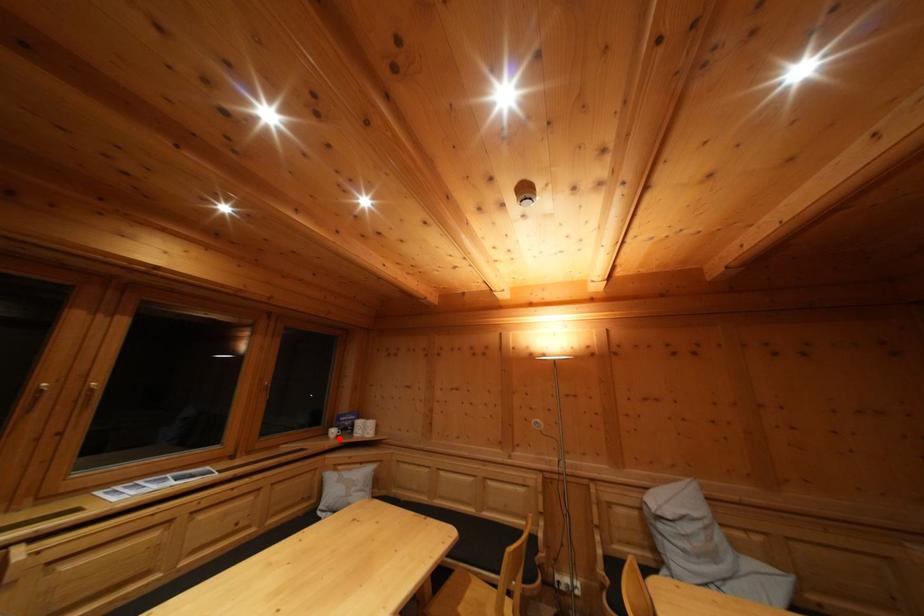
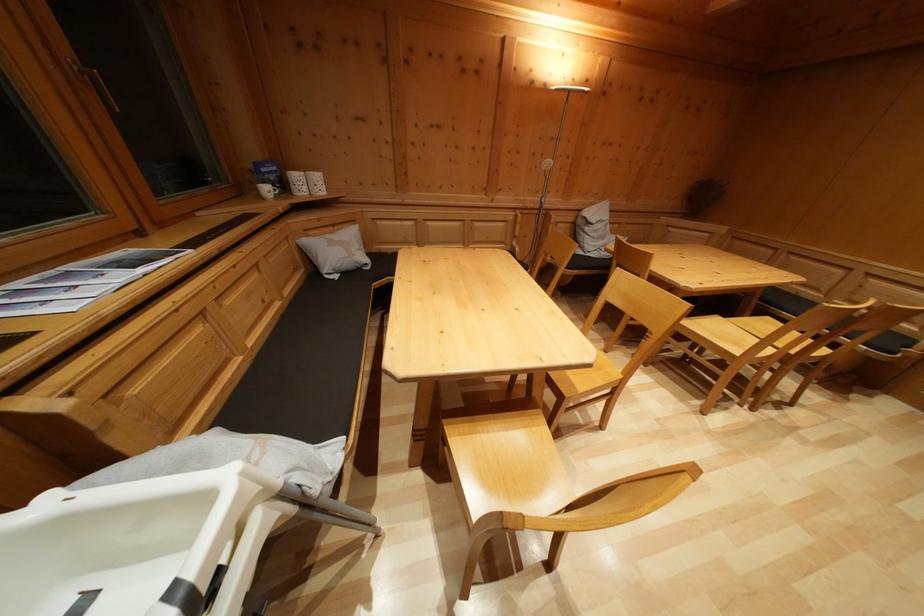
The point at the highlighted location is marked in the first image. Where is the corresponding point in the second image?

(273, 197)